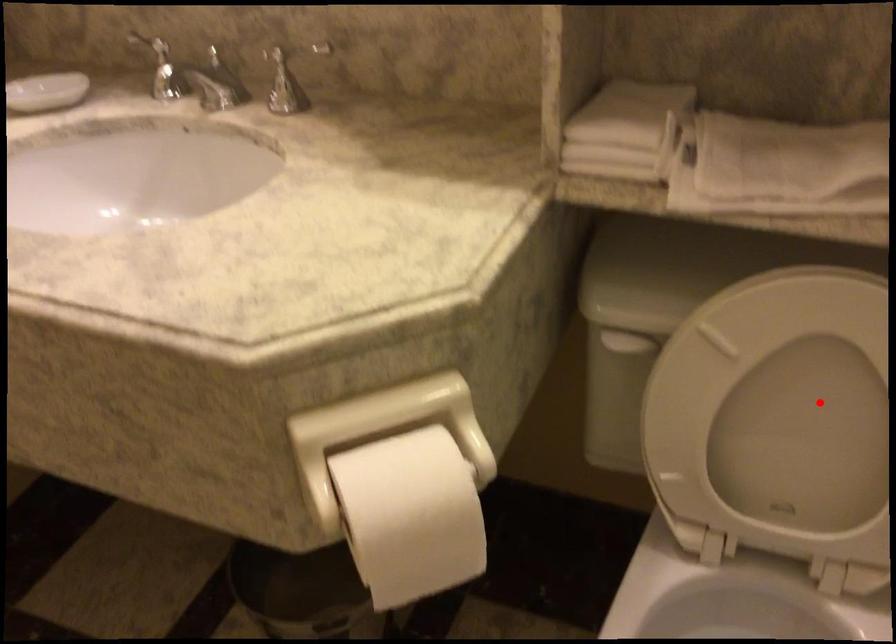
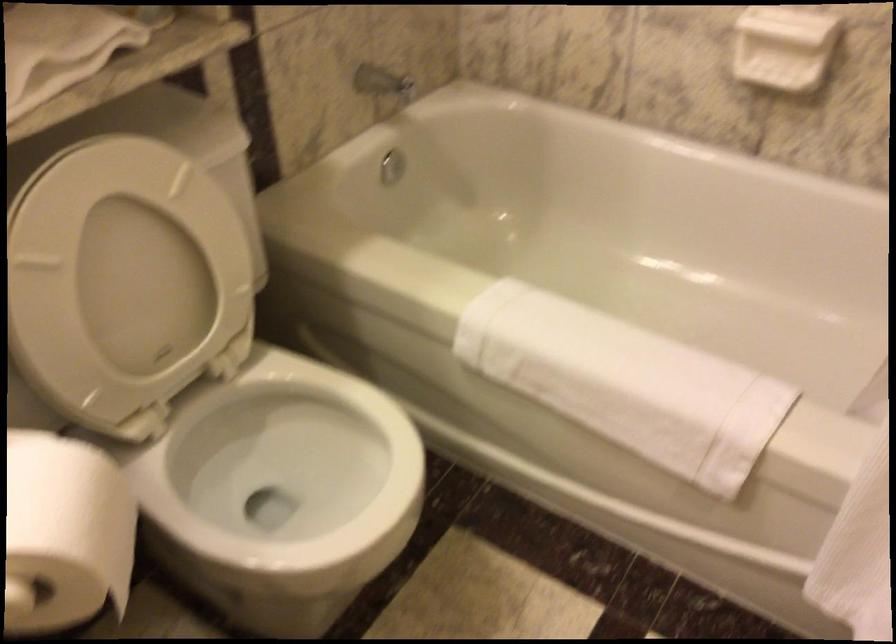
Where in the second image is the point corresponding to the highlighted location from the first image?

(126, 266)